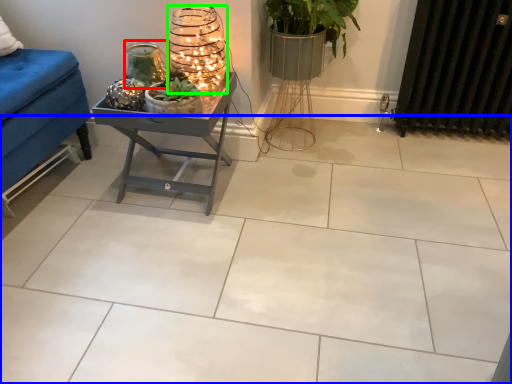
Question: Which is nearer to the candle holder (highlighted by a red box)? ceramic tile (highlighted by a blue box) or candle holder (highlighted by a green box).

Choices:
 (A) ceramic tile
 (B) candle holder

Answer: (B)